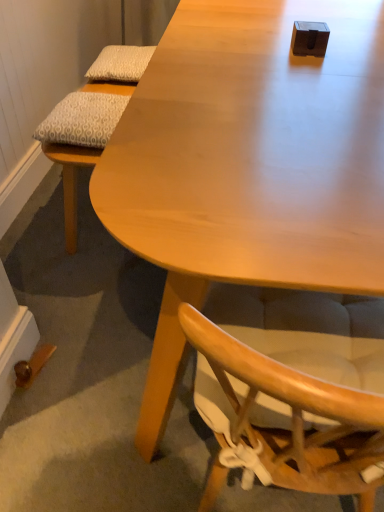
Identify the location of light wood desk at center. point(248,165).

This screenshot has height=512, width=384. Describe the element at coordinates (248, 165) in the screenshot. I see `light wood desk at center` at that location.

Locate an element on the screen. The height and width of the screenshot is (512, 384). light wood desk at center is located at coordinates (248, 165).